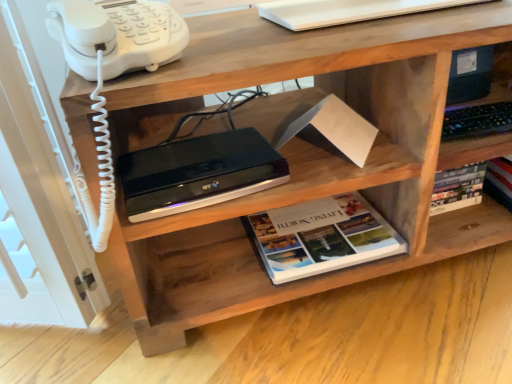
What do you see at coordinates (198, 173) in the screenshot? The width and height of the screenshot is (512, 384). I see `black plastic printer at upper center` at bounding box center [198, 173].

What do you see at coordinates (325, 242) in the screenshot? I see `hardcover book at center` at bounding box center [325, 242].

Locate an element on the screen. The image size is (512, 384). white plastic phone at upper left is located at coordinates (117, 35).

From a real-world perspective, is black plastic printer at upper center on hardcover book at center?

Yes, from a real-world perspective, black plastic printer at upper center is on top of hardcover book at center.

Can you confirm if black plastic printer at upper center is thinner than hardcover book at center?

Correct, the width of black plastic printer at upper center is less than that of hardcover book at center.

Would you say black plastic printer at upper center contains hardcover book at center?

No, hardcover book at center is not inside black plastic printer at upper center.

Are black plastic printer at upper center and hardcover book at center making contact?

black plastic printer at upper center and hardcover book at center are clearly separated.

Considering the sizes of objects hardcover book at center and white plastic phone at upper left in the image provided, who is wider, hardcover book at center or white plastic phone at upper left?

hardcover book at center is wider.

Considering the positions of point (311, 263) and point (88, 13), is point (311, 263) closer or farther from the camera than point (88, 13)?

Point (311, 263) appears to be farther away from the viewer than point (88, 13).

The width and height of the screenshot is (512, 384). In the image, there is a white plastic phone at upper left. Find the location of `book below it (from the image's perspective)`. book below it (from the image's perspective) is located at coordinates (325, 242).

Do you think hardcover book at center is within white plastic phone at upper left, or outside of it?

The correct answer is: outside.

Can you confirm if white plastic phone at upper left is taller than black plastic printer at upper center?

Yes.

Based on the photo, considering the positions of objects white plastic phone at upper left and black plastic printer at upper center in the image provided, who is more to the right, white plastic phone at upper left or black plastic printer at upper center?

black plastic printer at upper center.

Is point (87, 6) in front of point (130, 176)?

Yes, point (87, 6) is closer to viewer.

Is the surface of white plastic phone at upper left in direct contact with black plastic printer at upper center?

white plastic phone at upper left and black plastic printer at upper center are not in contact.

From a real-world perspective, is hardcover book at center above or below black plastic printer at upper center?

hardcover book at center is situated lower than black plastic printer at upper center in the real world.

Considering the relative sizes of hardcover book at center and black plastic printer at upper center in the image provided, is hardcover book at center thinner than black plastic printer at upper center?

No.

From the picture: Is hardcover book at center positioned with its back to black plastic printer at upper center?

hardcover book at center does not have its back to black plastic printer at upper center.

From a real-world perspective, which is physically above, black plastic printer at upper center or white plastic phone at upper left?

white plastic phone at upper left.

Considering the sizes of objects black plastic printer at upper center and white plastic phone at upper left in the image provided, who is bigger, black plastic printer at upper center or white plastic phone at upper left?

white plastic phone at upper left is bigger.

Does black plastic printer at upper center appear on the left side of white plastic phone at upper left?

In fact, black plastic printer at upper center is to the right of white plastic phone at upper left.

This screenshot has height=384, width=512. I want to click on corded phone located above the black plastic printer at upper center (from a real-world perspective), so click(x=117, y=35).

Is white plastic phone at upper left turned away from hardcover book at center?

That's not correct — white plastic phone at upper left is not looking away from hardcover book at center.

Between point (87, 38) and point (268, 265), which one is positioned behind?

The point (268, 265) is behind.

Which is in front, white plastic phone at upper left or hardcover book at center?

white plastic phone at upper left.

The image size is (512, 384). What are the coordinates of `computer that appears on the left of hardcover book at center` in the screenshot? It's located at [x=198, y=173].

Identify the location of corded phone above the hardcover book at center (from the image's perspective). The image size is (512, 384). (117, 35).

Based on the photo, looking at the image, which one is located further to black plastic printer at upper center, white plastic phone at upper left or hardcover book at center?

hardcover book at center is further to black plastic printer at upper center.

Looking at the image, which one is located further to hardcover book at center, white plastic phone at upper left or black plastic printer at upper center?

The object further to hardcover book at center is white plastic phone at upper left.

Looking at the image, which one is located closer to white plastic phone at upper left, hardcover book at center or black plastic printer at upper center?

black plastic printer at upper center is closer to white plastic phone at upper left.

From the image, which object appears to be farther from hardcover book at center, black plastic printer at upper center or white plastic phone at upper left?

The object further to hardcover book at center is white plastic phone at upper left.

Estimate the real-world distances between objects in this image. Which object is further from black plastic printer at upper center, hardcover book at center or white plastic phone at upper left?

hardcover book at center.

Estimate the real-world distances between objects in this image. Which object is closer to white plastic phone at upper left, black plastic printer at upper center or hardcover book at center?

black plastic printer at upper center lies closer to white plastic phone at upper left than the other object.

This screenshot has width=512, height=384. I want to click on computer situated between white plastic phone at upper left and hardcover book at center from left to right, so click(198, 173).